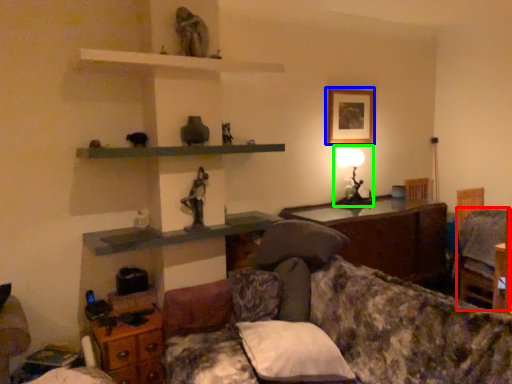
Question: Which object is the farthest from swivel chair (highlighted by a red box)? Choose among these: picture frame (highlighted by a blue box) or table lamp (highlighted by a green box).

Choices:
 (A) picture frame
 (B) table lamp

Answer: (A)